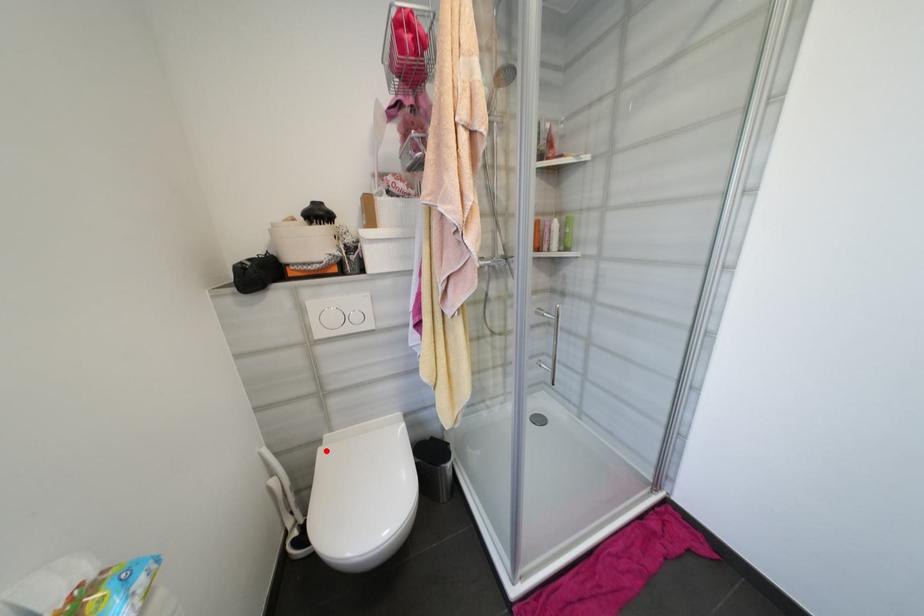
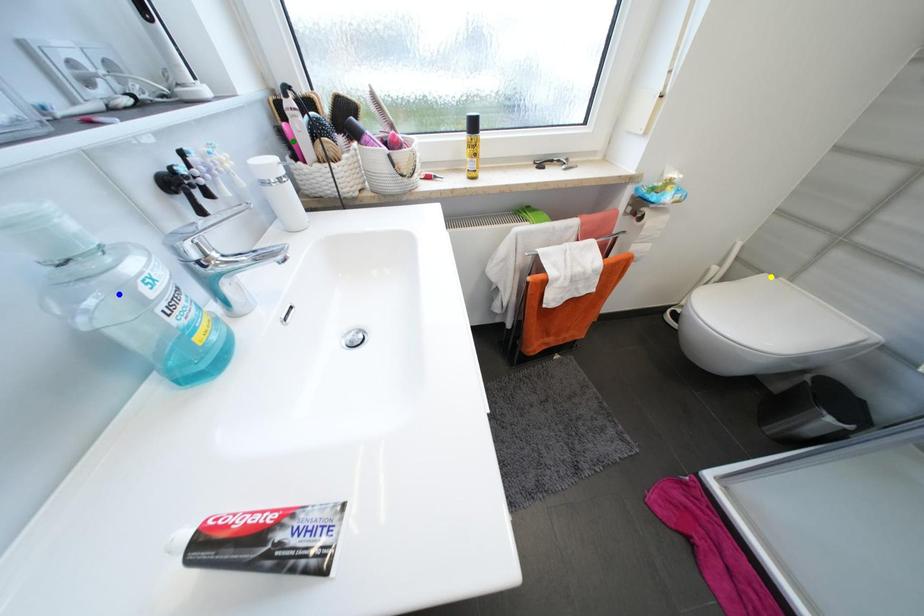
Question: I am providing you with two images of the same scene from different viewpoints. A red point is marked on the first image. You are given multiple points on the second image. Which spot in image 2 lines up with the point in image 1?

Choices:
 (A) blue point
 (B) green point
 (C) yellow point

Answer: (C)